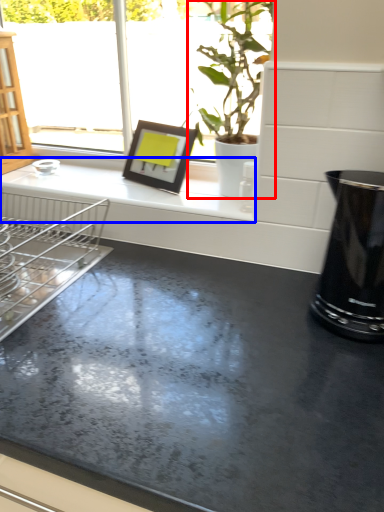
Question: Which object appears closest to the camera in this image, houseplant (highlighted by a red box) or counter top (highlighted by a blue box)?

Choices:
 (A) houseplant
 (B) counter top

Answer: (A)